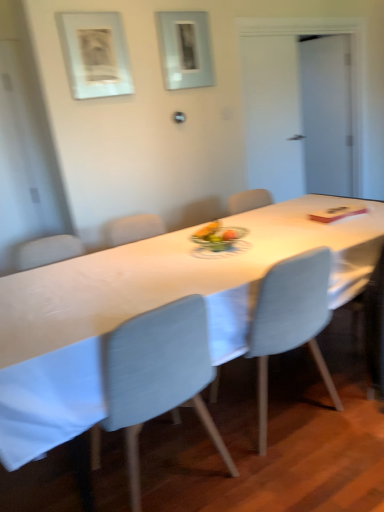
You are a GUI agent. You are given a task and a screenshot of the screen. Output one action in this format:
    pyautogui.click(x=<x>, y=<y>)
    Task: Click on the white glossy table at center
    
    Given the screenshot: What is the action you would take?
    pyautogui.click(x=150, y=308)

What is the approximate width of transparent glass door at upper right?

4.44 inches.

Where is `transparent glass door at upper right`? The image size is (384, 512). transparent glass door at upper right is located at coordinates (327, 113).

I want to click on light blue fabric chair at center, placed as the first chair when sorted from right to left, so click(290, 321).

Locate an element on the screen. light blue fabric chair at center, which appears as the second chair when viewed from the right is located at coordinates (158, 375).

This screenshot has width=384, height=512. What do you see at coordinates (185, 49) in the screenshot? I see `metallic gray picture frame at upper center, placed as the 1th picture frame when sorted from back to front` at bounding box center [185, 49].

What is the approximate height of metallic gray picture frame at upper center, positioned as the 1th picture frame in right-to-left order?

The height of metallic gray picture frame at upper center, positioned as the 1th picture frame in right-to-left order, is 51.31 centimeters.

Locate an element on the screen. white glossy table at center is located at coordinates (150, 308).

From their relative heights in the image, would you say white matte picture frame at upper left, which is counted as the 2th picture frame, starting from the back, is taller or shorter than light blue fabric chair at center, the 1th chair when ordered from left to right?

white matte picture frame at upper left, which is counted as the 2th picture frame, starting from the back, is shorter than light blue fabric chair at center, the 1th chair when ordered from left to right.

Is white matte picture frame at upper left, which is counted as the 2th picture frame, starting from the back, bigger than light blue fabric chair at center, which appears as the second chair when viewed from the right?

No, white matte picture frame at upper left, which is counted as the 2th picture frame, starting from the back, is not bigger than light blue fabric chair at center, which appears as the second chair when viewed from the right.

Which object is closer to the camera, white matte picture frame at upper left, which is counted as the 2th picture frame, starting from the back, or light blue fabric chair at center, which appears as the second chair when viewed from the right?

light blue fabric chair at center, which appears as the second chair when viewed from the right, is more forward.

Can you confirm if white matte picture frame at upper left, positioned as the 1th picture frame in front-to-back order, is positioned to the right of light blue fabric chair at center, which appears as the second chair when viewed from the right?

Incorrect, white matte picture frame at upper left, positioned as the 1th picture frame in front-to-back order, is not on the right side of light blue fabric chair at center, which appears as the second chair when viewed from the right.

From a real-world perspective, is white glossy table at center physically located above or below light blue fabric chair at center, the 1th chair when ordered from left to right?

Clearly, from a real-world perspective, white glossy table at center is above light blue fabric chair at center, the 1th chair when ordered from left to right.

How many degrees apart are the facing directions of white glossy table at center and light blue fabric chair at center, the 1th chair when ordered from left to right?

The angle between the facing direction of white glossy table at center and the facing direction of light blue fabric chair at center, the 1th chair when ordered from left to right, is 179 degrees.

From their relative heights in the image, would you say white glossy table at center is taller or shorter than light blue fabric chair at center, the 1th chair when ordered from left to right?

In the image, white glossy table at center appears to be shorter than light blue fabric chair at center, the 1th chair when ordered from left to right.

This screenshot has width=384, height=512. I want to click on table above the light blue fabric chair at center, the 1th chair when ordered from left to right (from a real-world perspective), so click(x=150, y=308).

In terms of size, does white glossy table at center appear bigger or smaller than light blue fabric chair at center, placed as the first chair when sorted from right to left?

In the image, white glossy table at center appears to be larger than light blue fabric chair at center, placed as the first chair when sorted from right to left.

Who is taller, white glossy table at center or light blue fabric chair at center, the 2th chair in the left-to-right sequence?

Standing taller between the two is light blue fabric chair at center, the 2th chair in the left-to-right sequence.

Based on the photo, considering the sizes of objects white glossy table at center and light blue fabric chair at center, the 2th chair in the left-to-right sequence, in the image provided, who is wider, white glossy table at center or light blue fabric chair at center, the 2th chair in the left-to-right sequence,?

With larger width is white glossy table at center.

Which is more to the right, white glossy table at center or light blue fabric chair at center, the 2th chair in the left-to-right sequence?

From the viewer's perspective, light blue fabric chair at center, the 2th chair in the left-to-right sequence, appears more on the right side.

From a real-world perspective, between light blue fabric chair at center, placed as the first chair when sorted from right to left, and white glossy table at center, who is vertically higher?

white glossy table at center is physically above.

Is light blue fabric chair at center, placed as the first chair when sorted from right to left, not near white glossy table at center?

They are positioned close to each other.

In terms of size, does light blue fabric chair at center, the 2th chair in the left-to-right sequence, appear bigger or smaller than white glossy table at center?

Clearly, light blue fabric chair at center, the 2th chair in the left-to-right sequence, is smaller in size than white glossy table at center.

Between point (317, 358) and point (59, 443), which one is positioned in front?

The point (59, 443) is in front.

How many degrees apart are the facing directions of light blue fabric chair at center, which appears as the second chair when viewed from the right, and metallic gray picture frame at upper center, which is counted as the second picture frame, starting from the front?

The angular difference between light blue fabric chair at center, which appears as the second chair when viewed from the right, and metallic gray picture frame at upper center, which is counted as the second picture frame, starting from the front, is 178 degrees.

Considering the sizes of objects light blue fabric chair at center, the 1th chair when ordered from left to right, and metallic gray picture frame at upper center, marked as the 2th picture frame in a left-to-right arrangement, in the image provided, who is bigger, light blue fabric chair at center, the 1th chair when ordered from left to right, or metallic gray picture frame at upper center, marked as the 2th picture frame in a left-to-right arrangement,?

light blue fabric chair at center, the 1th chair when ordered from left to right.

Is metallic gray picture frame at upper center, placed as the 1th picture frame when sorted from back to front, at the back of light blue fabric chair at center, which appears as the second chair when viewed from the right?

No, metallic gray picture frame at upper center, placed as the 1th picture frame when sorted from back to front, is not at the back of light blue fabric chair at center, which appears as the second chair when viewed from the right.

In the image, there is a light blue fabric chair at center, placed as the first chair when sorted from right to left. Where is `chair below it (from the image's perspective)`? chair below it (from the image's perspective) is located at coordinates (158, 375).

Is the depth of light blue fabric chair at center, placed as the first chair when sorted from right to left, less than that of light blue fabric chair at center, which appears as the second chair when viewed from the right?

No, light blue fabric chair at center, placed as the first chair when sorted from right to left, is further to the viewer.

Does light blue fabric chair at center, the 2th chair in the left-to-right sequence, have a greater height compared to light blue fabric chair at center, which appears as the second chair when viewed from the right?

Incorrect, the height of light blue fabric chair at center, the 2th chair in the left-to-right sequence, is not larger of that of light blue fabric chair at center, which appears as the second chair when viewed from the right.

From the image's perspective, which is above, light blue fabric chair at center, placed as the first chair when sorted from right to left, or light blue fabric chair at center, the 1th chair when ordered from left to right?

light blue fabric chair at center, placed as the first chair when sorted from right to left, from the image's perspective.

Looking at this image, could you measure the distance between white matte picture frame at upper left, positioned as the 1th picture frame in front-to-back order, and transparent glass door at upper right?

They are 7.63 feet apart.

Is white matte picture frame at upper left, the second picture frame when ordered from right to left, facing away from transparent glass door at upper right?

No, white matte picture frame at upper left, the second picture frame when ordered from right to left, is not facing away from transparent glass door at upper right.

Is white matte picture frame at upper left, which appears as the first picture frame when viewed from the left, not within transparent glass door at upper right?

Yes, white matte picture frame at upper left, which appears as the first picture frame when viewed from the left, is outside of transparent glass door at upper right.

How different are the orientations of white matte picture frame at upper left, which appears as the first picture frame when viewed from the left, and transparent glass door at upper right in degrees?

The angle between the facing direction of white matte picture frame at upper left, which appears as the first picture frame when viewed from the left, and the facing direction of transparent glass door at upper right is 68.8 degrees.

Locate an element on the screen. chair that is the 1st object to the right of the white matte picture frame at upper left, which appears as the first picture frame when viewed from the left, starting at the anchor is located at coordinates (158, 375).

At what (x,y) coordinates should I click in order to perform the action: click on table positioned vertically above the light blue fabric chair at center, the 1th chair when ordered from left to right (from a real-world perspective). Please return your answer as a coordinate pair (x, y). Looking at the image, I should click on (150, 308).

Which object lies further to the anchor point white glossy table at center, transparent glass door at upper right or metallic gray picture frame at upper center, placed as the 1th picture frame when sorted from back to front?

Based on the image, transparent glass door at upper right appears to be further to white glossy table at center.

Considering their positions, is white glossy table at center positioned closer to transparent glass door at upper right than white matte picture frame at upper left, the second picture frame when ordered from right to left?

white matte picture frame at upper left, the second picture frame when ordered from right to left, lies closer to transparent glass door at upper right than the other object.

Looking at this image, from the image, which object appears to be farther from white glossy table at center, metallic gray picture frame at upper center, which is counted as the second picture frame, starting from the front, or white matte picture frame at upper left, the second picture frame when ordered from right to left?

Among the two, metallic gray picture frame at upper center, which is counted as the second picture frame, starting from the front, is located further to white glossy table at center.

Considering their positions, is transparent glass door at upper right positioned closer to white matte picture frame at upper left, positioned as the 1th picture frame in front-to-back order, than white glossy table at center?

Among the two, white glossy table at center is located nearer to white matte picture frame at upper left, positioned as the 1th picture frame in front-to-back order.

Based on the photo, estimate the real-world distances between objects in this image. Which object is further from light blue fabric chair at center, the 1th chair when ordered from left to right, transparent glass door at upper right or white glossy table at center?

transparent glass door at upper right lies further to light blue fabric chair at center, the 1th chair when ordered from left to right, than the other object.

Based on their spatial positions, is light blue fabric chair at center, the 1th chair when ordered from left to right, or transparent glass door at upper right closer to light blue fabric chair at center, placed as the first chair when sorted from right to left?

Based on the image, light blue fabric chair at center, the 1th chair when ordered from left to right, appears to be nearer to light blue fabric chair at center, placed as the first chair when sorted from right to left.

Looking at the image, which one is located further to light blue fabric chair at center, which appears as the second chair when viewed from the right, white glossy table at center or metallic gray picture frame at upper center, which is counted as the second picture frame, starting from the front?

metallic gray picture frame at upper center, which is counted as the second picture frame, starting from the front, is further to light blue fabric chair at center, which appears as the second chair when viewed from the right.

Looking at the image, which one is located closer to light blue fabric chair at center, the 2th chair in the left-to-right sequence, white matte picture frame at upper left, positioned as the 1th picture frame in front-to-back order, or transparent glass door at upper right?

white matte picture frame at upper left, positioned as the 1th picture frame in front-to-back order, is positioned closer to the anchor light blue fabric chair at center, the 2th chair in the left-to-right sequence.

What are the coordinates of `table between white matte picture frame at upper left, positioned as the 1th picture frame in front-to-back order, and light blue fabric chair at center, placed as the first chair when sorted from right to left, vertically` in the screenshot? It's located at (150, 308).

Image resolution: width=384 pixels, height=512 pixels. Find the location of `table between metallic gray picture frame at upper center, which is counted as the second picture frame, starting from the front, and light blue fabric chair at center, the 2th chair in the left-to-right sequence, from top to bottom`. table between metallic gray picture frame at upper center, which is counted as the second picture frame, starting from the front, and light blue fabric chair at center, the 2th chair in the left-to-right sequence, from top to bottom is located at coordinates (150, 308).

You are a GUI agent. You are given a task and a screenshot of the screen. Output one action in this format:
    pyautogui.click(x=<x>, y=<y>)
    Task: Click on the chair between metallic gray picture frame at upper center, which is counted as the second picture frame, starting from the front, and light blue fabric chair at center, which appears as the second chair when viewed from the right, in the vertical direction
    
    Given the screenshot: What is the action you would take?
    pyautogui.click(x=290, y=321)

Find the location of `chair between white matte picture frame at upper left, the second picture frame when ordered from right to left, and light blue fabric chair at center, which appears as the second chair when viewed from the right, in the up-down direction`. chair between white matte picture frame at upper left, the second picture frame when ordered from right to left, and light blue fabric chair at center, which appears as the second chair when viewed from the right, in the up-down direction is located at coordinates (290, 321).